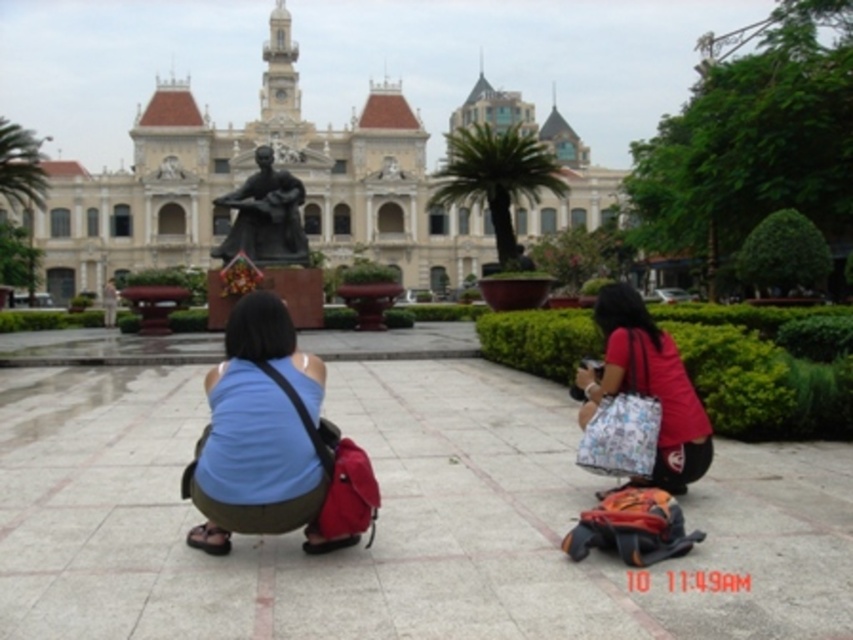
Question: Which object is the farthest from the matte red shirt at lower right?

Choices:
 (A) blue fabric tank top at center
 (B) bronze statue at center

Answer: (B)

Question: Does white stone building at center have a lesser width compared to blue fabric tank top at center?

Choices:
 (A) no
 (B) yes

Answer: (A)

Question: Among these points, which one is nearest to the camera?

Choices:
 (A) (608, 180)
 (B) (291, 240)
 (C) (225, 545)

Answer: (C)

Question: Which point is closer to the camera?

Choices:
 (A) (554, 154)
 (B) (622, 289)
 (C) (218, 246)

Answer: (B)

Question: Does matte red shirt at lower right appear over bronze statue at center?

Choices:
 (A) no
 (B) yes

Answer: (A)

Question: Is blue fabric tank top at center positioned before bronze statue at center?

Choices:
 (A) no
 (B) yes

Answer: (B)